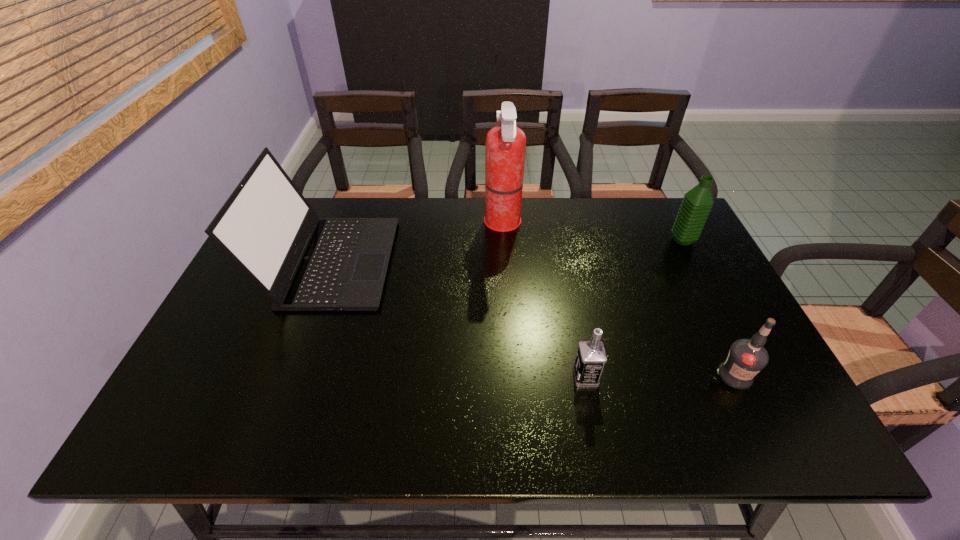
At what (x,y) coordinates should I click in order to perform the action: click on blank space at the near left corner of the desktop. Please return your answer as a coordinate pair (x, y). The height and width of the screenshot is (540, 960). Looking at the image, I should click on (185, 407).

In the image, there is a desktop. Find the location of `vacant space at the far right corner`. vacant space at the far right corner is located at coordinates (675, 204).

Find the location of `vacant space at the near right corner of the desktop`. vacant space at the near right corner of the desktop is located at coordinates (791, 420).

I want to click on vacant region between the third object from right to left and the second tallest object, so click(458, 320).

Identify the location of vacant space that is in between the tallest object and the fourth shortest object. The height and width of the screenshot is (540, 960). (417, 243).

This screenshot has height=540, width=960. Find the location of `vacant space that's between the water bottle and the taller vodka`. vacant space that's between the water bottle and the taller vodka is located at coordinates pos(708,308).

Locate an element on the screen. unoccupied area between the shorter vodka and the water bottle is located at coordinates (634, 309).

Identify the location of free space between the tallest object and the left vodka. (544, 301).

In order to click on empty space that is in between the third object from right to left and the laptop in this screenshot , I will do `click(458, 320)`.

The width and height of the screenshot is (960, 540). In order to click on unoccupied area between the water bottle and the second tallest object in this screenshot , I will do pyautogui.click(x=507, y=251).